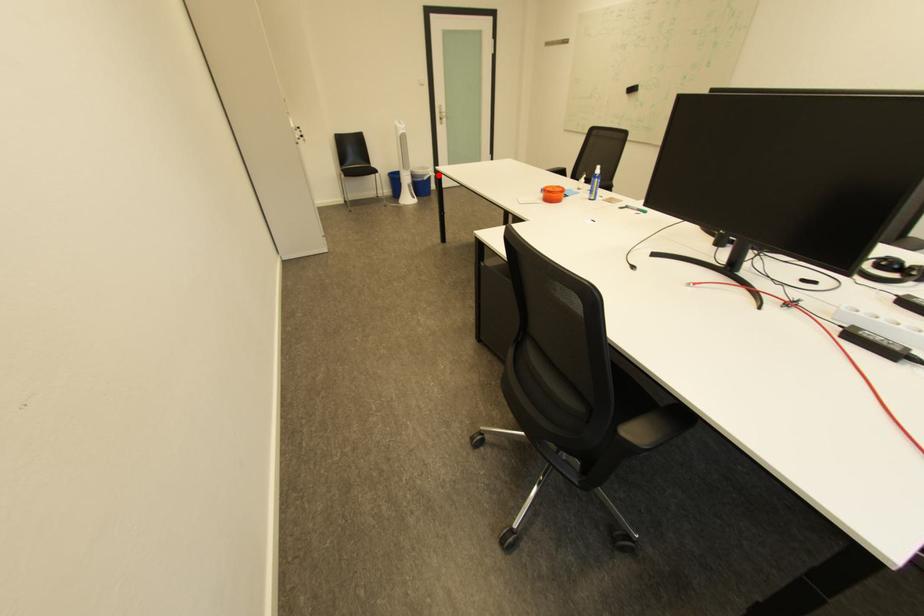
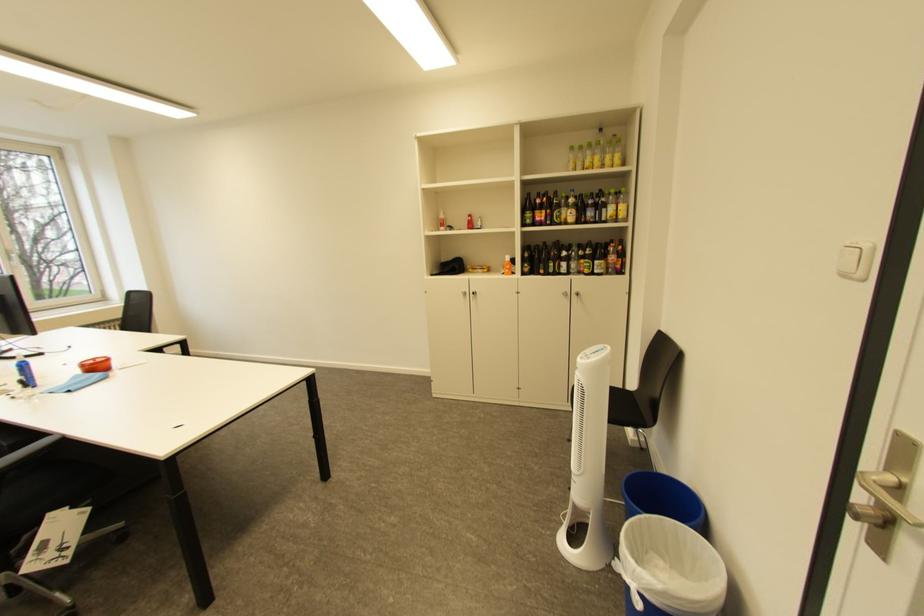
Where in the second image is the point corresponding to the highlighted location from the first image?

(636, 570)